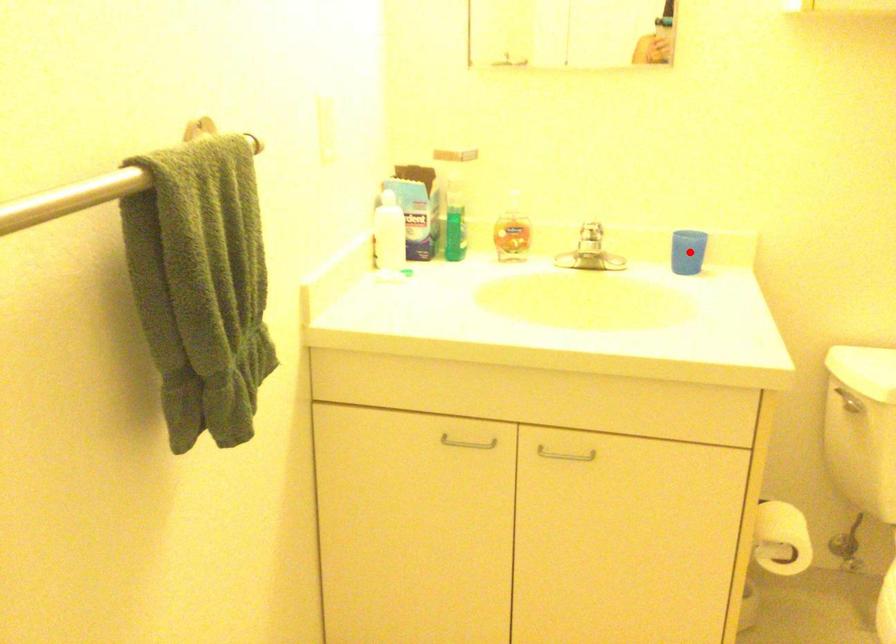
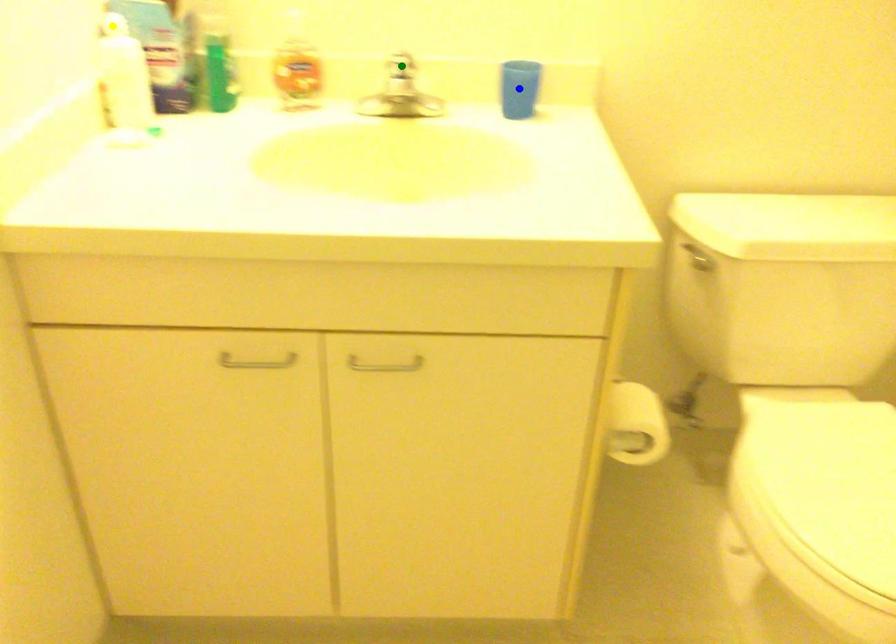
Question: I am providing you with two images of the same scene from different viewpoints. A red point is marked on the first image. You are given multiple points on the second image. Which mark in image 2 goes with the point in image 1?

Choices:
 (A) yellow point
 (B) green point
 (C) blue point

Answer: (C)